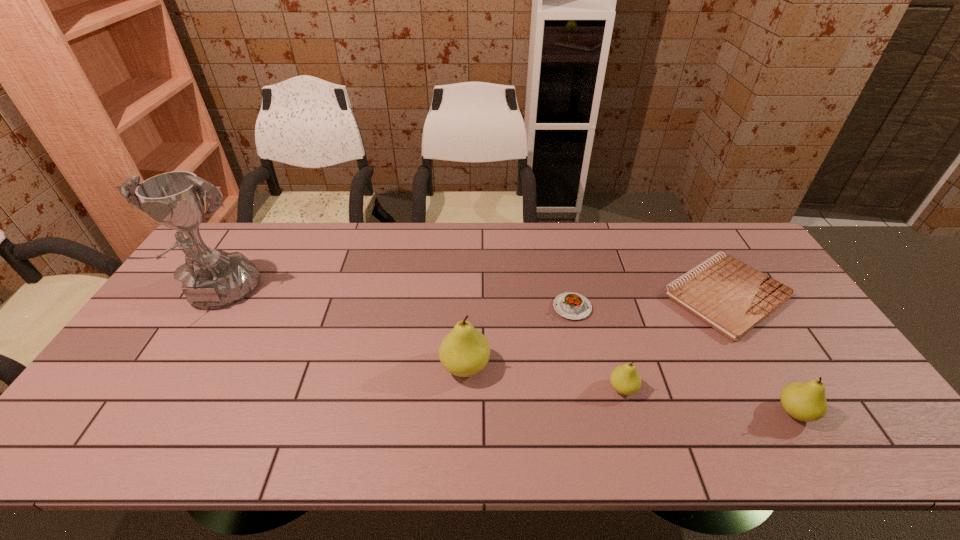
The image size is (960, 540). I want to click on the second object from left to right, so click(465, 351).

At what (x,y) coordinates should I click in order to perform the action: click on the tallest pear. Please return your answer as a coordinate pair (x, y). This screenshot has height=540, width=960. Looking at the image, I should click on coord(465,351).

Where is `the second pear from left to right`? the second pear from left to right is located at coordinates (625, 379).

At what (x,y) coordinates should I click in order to perform the action: click on the shortest pear. Please return your answer as a coordinate pair (x, y). Looking at the image, I should click on (625, 379).

Image resolution: width=960 pixels, height=540 pixels. What are the coordinates of `the second shortest pear` in the screenshot? It's located at (806, 401).

In order to click on the fourth shortest object in this screenshot , I will do `click(806, 401)`.

Locate an element on the screen. the shortest object is located at coordinates (732, 297).

This screenshot has height=540, width=960. Identify the location of pudding. (570, 305).

Find the location of a particular element. This screenshot has height=540, width=960. the tallest object is located at coordinates (212, 279).

This screenshot has width=960, height=540. Identify the location of award. (212, 279).